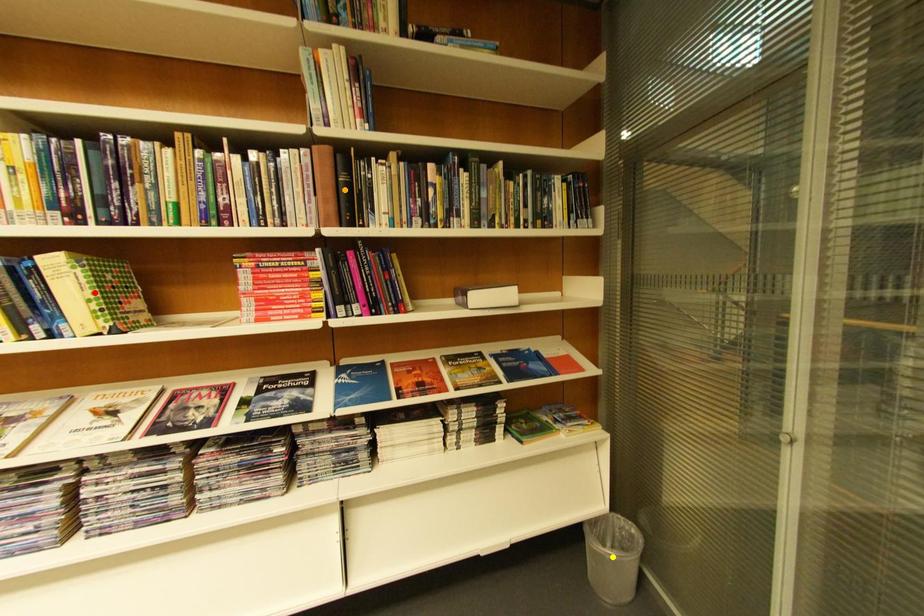
Order these from nearest to farthest:
A) orange point
B) red point
C) yellow point

red point → orange point → yellow point